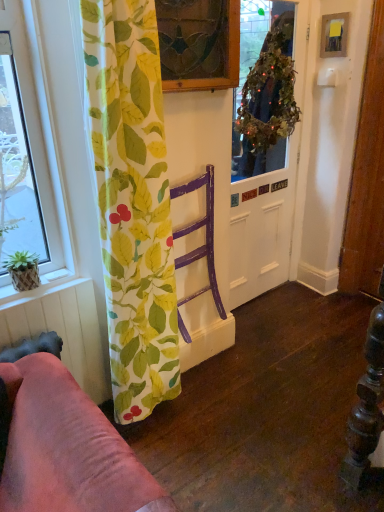
Find the location of `green leafy wreath at upper center`. green leafy wreath at upper center is located at coordinates (269, 91).

The height and width of the screenshot is (512, 384). Identify the location of purple wood chair at center. (199, 247).

Image resolution: width=384 pixels, height=512 pixels. What do you see at coordinates (23, 270) in the screenshot?
I see `green woven basket at lower left` at bounding box center [23, 270].

You are a GUI agent. You are given a task and a screenshot of the screen. Output one action in this format:
    pyautogui.click(x=<x>, y=<y>)
    Task: Click on the green leafy wreath at center
    The width and height of the screenshot is (384, 512).
    Given the screenshot: What is the action you would take?
    pyautogui.click(x=259, y=179)

Image resolution: width=384 pixels, height=512 pixels. Describe the element at coordinates (199, 44) in the screenshot. I see `stained glass window at upper center` at that location.

Locate an element on the screen. green leaf-patterned fabric at left is located at coordinates (132, 202).

Does metallic silver picture frame at upper right turn towards green leafy wreath at center?

No, metallic silver picture frame at upper right is not aimed at green leafy wreath at center.

From a real-world perspective, does metallic silver picture frame at upper right sit lower than green leafy wreath at center?

No, from a real-world perspective, metallic silver picture frame at upper right is not below green leafy wreath at center.

From the image's perspective, is metallic silver picture frame at upper right located beneath green leafy wreath at center?

No, from the image's perspective, metallic silver picture frame at upper right is not beneath green leafy wreath at center.

From the image's perspective, is purple wood chair at center below green leafy wreath at center?

Yes.

From a real-world perspective, is purple wood chair at center positioned above or below green leafy wreath at center?

purple wood chair at center is situated lower than green leafy wreath at center in the real world.

Is green leafy wreath at center surrounded by purple wood chair at center?

No, green leafy wreath at center is not surrounded by purple wood chair at center.

Considering the positions of points (206, 186) and (250, 258), is point (206, 186) closer to camera compared to point (250, 258)?

Yes, it is in front of point (250, 258).

Considering the sizes of objects woven bamboo plant pot at lower left and green leafy wreath at upper center in the image provided, who is smaller, woven bamboo plant pot at lower left or green leafy wreath at upper center?

woven bamboo plant pot at lower left.

Is woven bamboo plant pot at lower left positioned with its back to green leafy wreath at upper center?

No, woven bamboo plant pot at lower left is not facing away from green leafy wreath at upper center.

Is woven bamboo plant pot at lower left at the left side of green leafy wreath at upper center?

Correct, you'll find woven bamboo plant pot at lower left to the left of green leafy wreath at upper center.

How far apart are woven bamboo plant pot at lower left and green leafy wreath at upper center?

1.54 meters.

What's the angular difference between purple wood chair at center and stained glass window at upper center's facing directions?

They differ by 1.5 degrees in their facing directions.

Considering the sizes of objects purple wood chair at center and stained glass window at upper center in the image provided, who is bigger, purple wood chair at center or stained glass window at upper center?

purple wood chair at center is bigger.

Is purple wood chair at center wider than stained glass window at upper center?

Yes, purple wood chair at center is wider than stained glass window at upper center.

Is purple wood chair at center closer to camera compared to stained glass window at upper center?

No.

Who is shorter, green woven basket at lower left or green leafy wreath at upper center?

Standing shorter between the two is green woven basket at lower left.

Is the surface of green woven basket at lower left in direct contact with green leafy wreath at upper center?

They are not placed beside each other.

Find the location of a particular element. This screenshot has width=384, height=512. houseplant on the left side of green leafy wreath at upper center is located at coordinates (23, 270).

Looking at this image, measure the distance between green leafy wreath at upper center and stained glass window at upper center.

green leafy wreath at upper center and stained glass window at upper center are 26.16 inches apart.

In terms of width, does green leafy wreath at upper center look wider or thinner when compared to stained glass window at upper center?

green leafy wreath at upper center is wider than stained glass window at upper center.

Is green leafy wreath at upper center in front of or behind stained glass window at upper center in the image?

green leafy wreath at upper center is positioned farther from the viewer than stained glass window at upper center.

Is green leafy wreath at upper center not near stained glass window at upper center?

They are positioned close to each other.

Is green leafy wreath at upper center spatially inside green woven basket at lower left, or outside of it?

green leafy wreath at upper center is not enclosed by green woven basket at lower left.

This screenshot has height=512, width=384. I want to click on houseplant lying below the green leafy wreath at upper center (from the image's perspective), so click(23, 270).

Is green leafy wreath at upper center positioned in front of green woven basket at lower left?

That is False.

Locate an element on the screen. The height and width of the screenshot is (512, 384). picture frame behind the green leafy wreath at center is located at coordinates (334, 35).

Image resolution: width=384 pixels, height=512 pixels. I want to click on armchair that appears in front of the green leafy wreath at center, so click(199, 247).

Looking at the image, which one is located further to purple wood chair at center, metallic silver picture frame at upper right or green leafy wreath at center?

metallic silver picture frame at upper right is further to purple wood chair at center.

Based on their spatial positions, is green leaf-patterned fabric at left or metallic silver picture frame at upper right closer to stained glass window at upper center?

green leaf-patterned fabric at left is closer to stained glass window at upper center.

When comparing their distances from green woven basket at lower left, does green leaf-patterned fabric at left or woven bamboo plant pot at lower left seem closer?

Among the two, woven bamboo plant pot at lower left is located nearer to green woven basket at lower left.

Considering their positions, is green leafy wreath at center positioned further to green leafy wreath at upper center than stained glass window at upper center?

stained glass window at upper center is further to green leafy wreath at upper center.

Considering their positions, is green leaf-patterned fabric at left positioned closer to green leafy wreath at center than stained glass window at upper center?

stained glass window at upper center.

From the image, which object appears to be nearer to purple wood chair at center, woven bamboo plant pot at lower left or metallic silver picture frame at upper right?

The object closer to purple wood chair at center is woven bamboo plant pot at lower left.

From the image, which object appears to be nearer to green woven basket at lower left, green leafy wreath at upper center or green leaf-patterned fabric at left?

green leaf-patterned fabric at left.

When comparing their distances from purple wood chair at center, does green leaf-patterned fabric at left or green leafy wreath at upper center seem closer?

Among the two, green leaf-patterned fabric at left is located nearer to purple wood chair at center.

I want to click on armchair between metallic silver picture frame at upper right and woven bamboo plant pot at lower left in the vertical direction, so click(x=199, y=247).

You are a GUI agent. You are given a task and a screenshot of the screen. Output one action in this format:
    pyautogui.click(x=<x>, y=<y>)
    Task: Click on the door between metallic silver picture frame at upper right and purple wood chair at center from top to bottom
    The height and width of the screenshot is (512, 384).
    Given the screenshot: What is the action you would take?
    pyautogui.click(x=259, y=179)

Find the location of a particular element. The height and width of the screenshot is (512, 384). curtain between woven bamboo plant pot at lower left and green leafy wreath at center is located at coordinates (132, 202).

Identify the location of houseplant between green leaf-patterned fabric at left and woven bamboo plant pot at lower left from front to back. The height and width of the screenshot is (512, 384). (23, 270).